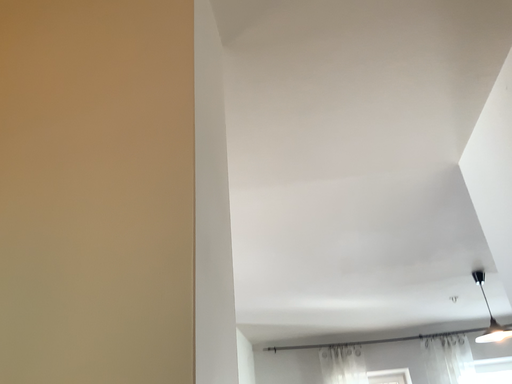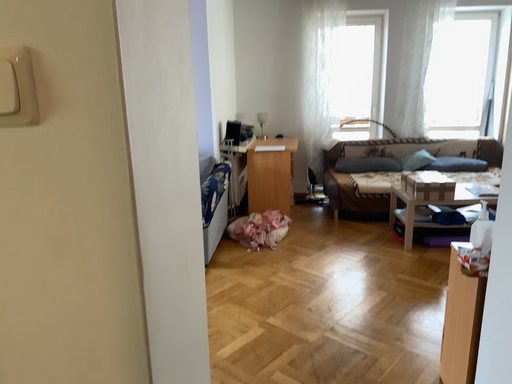
Question: Which way did the camera rotate in the video?

Choices:
 (A) rotated downward
 (B) rotated upward

Answer: (A)